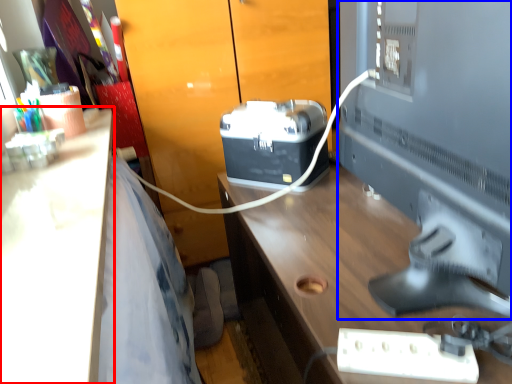
Question: Among these objects, which one is farthest to the camera, desk (highlighted by a red box) or desktop computer (highlighted by a blue box)?

Choices:
 (A) desk
 (B) desktop computer

Answer: (B)